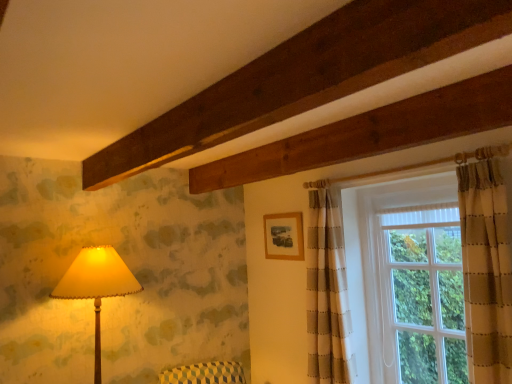
Question: Can white textured glass window at upper right, the 1th window positioned from the left, be found inside matte cream lampshade at left?

Choices:
 (A) yes
 (B) no

Answer: (B)

Question: Is matte cream lampshade at left oriented away from white textured glass window at upper right, which ranks as the second window in right-to-left order?

Choices:
 (A) yes
 (B) no

Answer: (B)

Question: Is matte cream lampshade at left bigger than white textured glass window at upper right, the 1th window positioned from the left?

Choices:
 (A) yes
 (B) no

Answer: (B)

Question: Is matte cream lampshade at left shorter than white textured glass window at upper right, which ranks as the second window in right-to-left order?

Choices:
 (A) no
 (B) yes

Answer: (B)

Question: Is matte cream lampshade at left further to the viewer compared to white textured glass window at upper right, which ranks as the second window in right-to-left order?

Choices:
 (A) no
 (B) yes

Answer: (B)

Question: Considering their positions, is clear glass window at right, the 1th window positioned from the right, located in front of or behind white textured glass window at upper right, which ranks as the second window in right-to-left order?

Choices:
 (A) behind
 (B) front

Answer: (A)

Question: Is point (389, 307) closer or farther from the camera than point (307, 322)?

Choices:
 (A) farther
 (B) closer

Answer: (B)

Question: From a real-world perspective, is clear glass window at right, arranged as the 2th window when viewed from the left, above or below white textured glass window at upper right, which ranks as the second window in right-to-left order?

Choices:
 (A) above
 (B) below

Answer: (B)

Question: Considering the positions of clear glass window at right, the 1th window positioned from the right, and white textured glass window at upper right, the 1th window positioned from the left, in the image, is clear glass window at right, the 1th window positioned from the right, wider or thinner than white textured glass window at upper right, the 1th window positioned from the left,?

Choices:
 (A) thin
 (B) wide

Answer: (A)

Question: Looking at their shapes, would you say clear glass window at right, arranged as the 2th window when viewed from the left, is wider or thinner than matte cream lampshade at left?

Choices:
 (A) thin
 (B) wide

Answer: (A)

Question: In the image, is clear glass window at right, the 1th window positioned from the right, positioned in front of or behind matte cream lampshade at left?

Choices:
 (A) front
 (B) behind

Answer: (B)

Question: Is point (453, 294) closer or farther from the camera than point (128, 289)?

Choices:
 (A) closer
 (B) farther

Answer: (A)

Question: Considering the positions of clear glass window at right, arranged as the 2th window when viewed from the left, and matte cream lampshade at left in the image, is clear glass window at right, arranged as the 2th window when viewed from the left, taller or shorter than matte cream lampshade at left?

Choices:
 (A) short
 (B) tall

Answer: (B)

Question: Is point (93, 284) closer or farther from the camera than point (282, 226)?

Choices:
 (A) farther
 (B) closer

Answer: (B)

Question: Is matte cream lampshade at left in front of or behind wooden frame at upper center in the image?

Choices:
 (A) front
 (B) behind

Answer: (A)